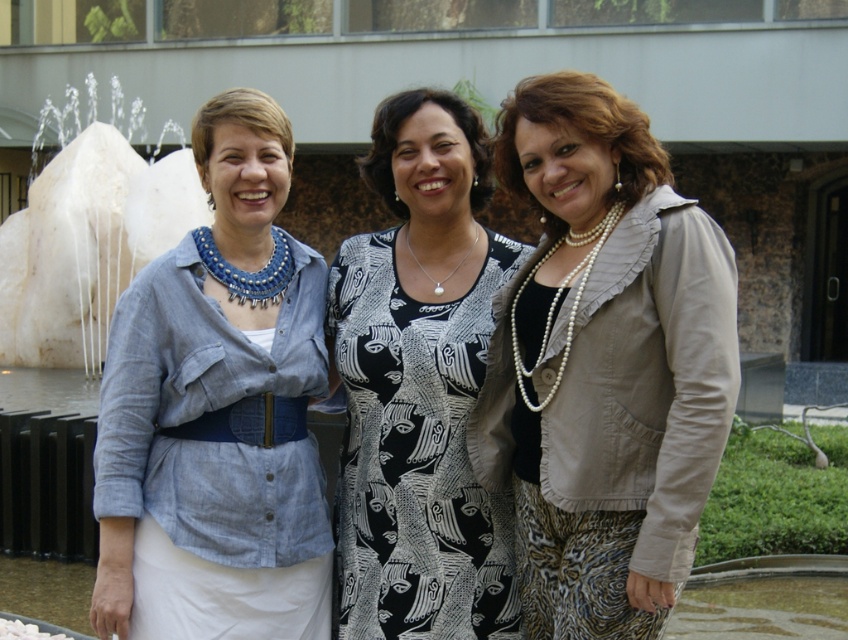
Question: Which point appears closest to the camera in this image?

Choices:
 (A) (42, 352)
 (B) (618, 349)
 (C) (240, 93)
 (D) (355, 260)

Answer: (B)

Question: Is pearl fabric jacket at center closer to the viewer compared to black printed fabric dress at center?

Choices:
 (A) yes
 (B) no

Answer: (A)

Question: Which is nearer to the black printed fabric dress at center?

Choices:
 (A) denim shirt at left
 (B) pearl fabric jacket at center
 (C) white marble fountain at left

Answer: (A)

Question: Is denim shirt at left to the right of black printed fabric dress at center from the viewer's perspective?

Choices:
 (A) no
 (B) yes

Answer: (A)

Question: Which point is farther to the camera?

Choices:
 (A) black printed fabric dress at center
 (B) denim shirt at left

Answer: (A)

Question: Is pearl fabric jacket at center above denim shirt at left?

Choices:
 (A) yes
 (B) no

Answer: (A)